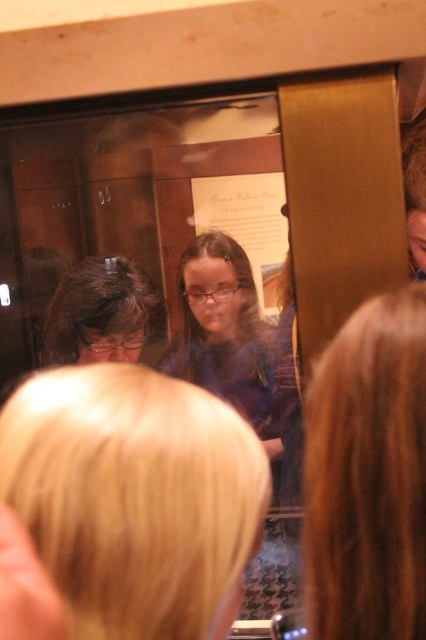
Who is lower down, blonde hair at upper center or dark brown hair at left?

Positioned lower is blonde hair at upper center.

Is point (405, 621) closer to camera compared to point (123, 307)?

Yes.

Find the location of a particular element. The width and height of the screenshot is (426, 640). blonde hair at upper center is located at coordinates (367, 476).

Is blonde hair at upper center positioned before purple fabric at center?

Yes, blonde hair at upper center is in front of purple fabric at center.

Is point (311, 480) behind point (264, 419)?

No, it is not.

Is point (339, 563) closer to camera compared to point (201, 381)?

That is True.

The height and width of the screenshot is (640, 426). In order to click on blonde hair at upper center in this screenshot , I will do `click(367, 476)`.

Is purple fabric at center further to the viewer compared to dark brown hair at left?

No, it is in front of dark brown hair at left.

Between purple fabric at center and dark brown hair at left, which one appears on the right side from the viewer's perspective?

From the viewer's perspective, purple fabric at center appears more on the right side.

Which is in front, point (270, 376) or point (80, 349)?

Point (270, 376) is in front.

Locate an element on the screen. This screenshot has height=640, width=426. purple fabric at center is located at coordinates (221, 326).